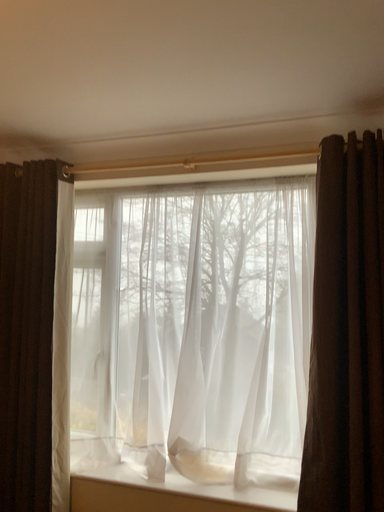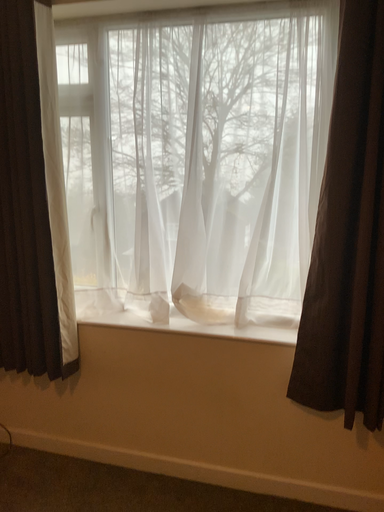
Question: Which way did the camera rotate in the video?

Choices:
 (A) rotated upward
 (B) rotated downward

Answer: (B)